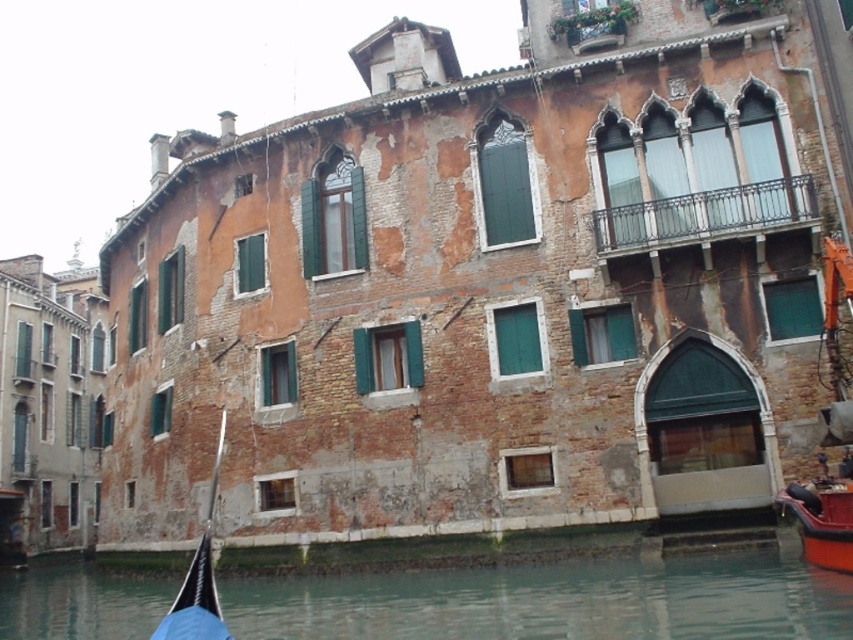
Between clear water at lower center and black fabric boat at lower left, which one appears on the left side from the viewer's perspective?

clear water at lower center is more to the left.

The width and height of the screenshot is (853, 640). I want to click on clear water at lower center, so click(x=552, y=600).